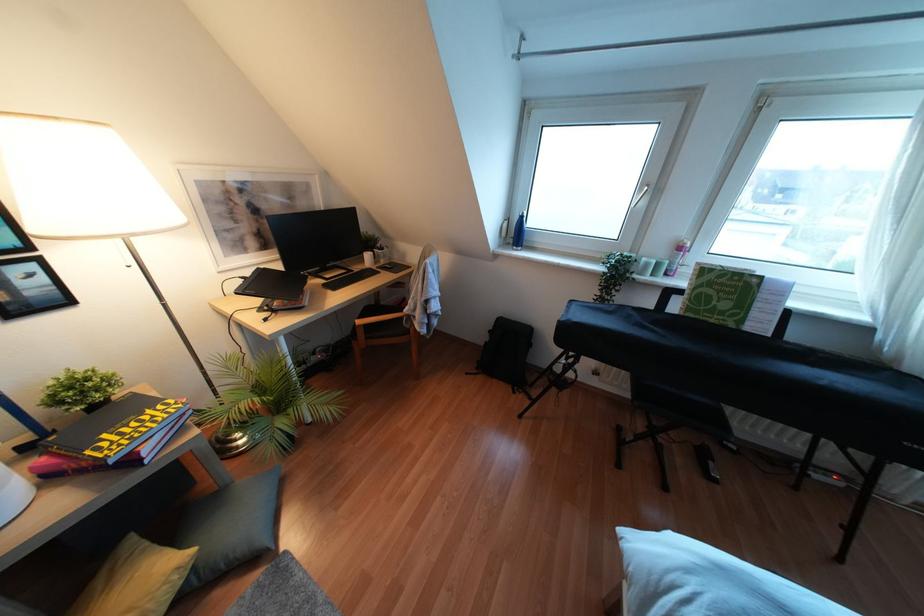
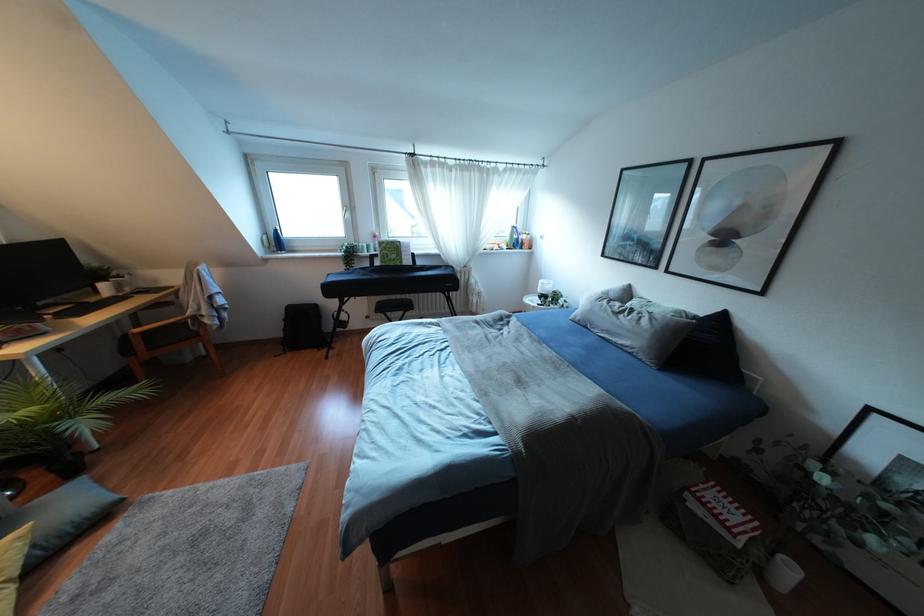
Where in the second image is the point corresponding to the point at 642,201 from the first image?

(346, 215)